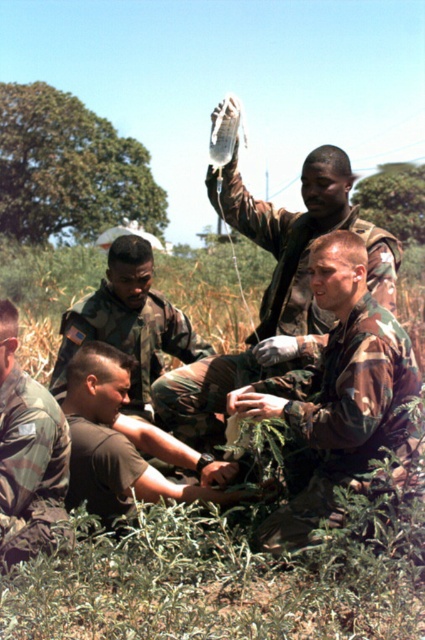
Is camouflage fabric uniform at center in front of camouflage uniform at center?

Yes, camouflage fabric uniform at center is in front of camouflage uniform at center.

Consider the image. Is camouflage fabric uniform at center taller than camouflage uniform at center?

Incorrect, camouflage fabric uniform at center's height is not larger of camouflage uniform at center's.

Find the location of a particular element. camouflage fabric uniform at center is located at coordinates (340, 392).

From the picture: Is brown camo uniform at center below camouflage uniform at lower left?

Correct, brown camo uniform at center is located below camouflage uniform at lower left.

Image resolution: width=425 pixels, height=640 pixels. What do you see at coordinates (121, 442) in the screenshot? I see `brown camo uniform at center` at bounding box center [121, 442].

This screenshot has width=425, height=640. Identify the location of brown camo uniform at center. (121, 442).

This screenshot has width=425, height=640. I want to click on brown camo uniform at center, so click(121, 442).

Does camouflage fabric uniform at center have a greater width compared to brown camo uniform at center?

In fact, camouflage fabric uniform at center might be narrower than brown camo uniform at center.

Can you confirm if camouflage fabric uniform at center is positioned below brown camo uniform at center?

No, camouflage fabric uniform at center is not below brown camo uniform at center.

The height and width of the screenshot is (640, 425). What do you see at coordinates (340, 392) in the screenshot? I see `camouflage fabric uniform at center` at bounding box center [340, 392].

Locate an element on the screen. The image size is (425, 640). camouflage fabric uniform at center is located at coordinates (340, 392).